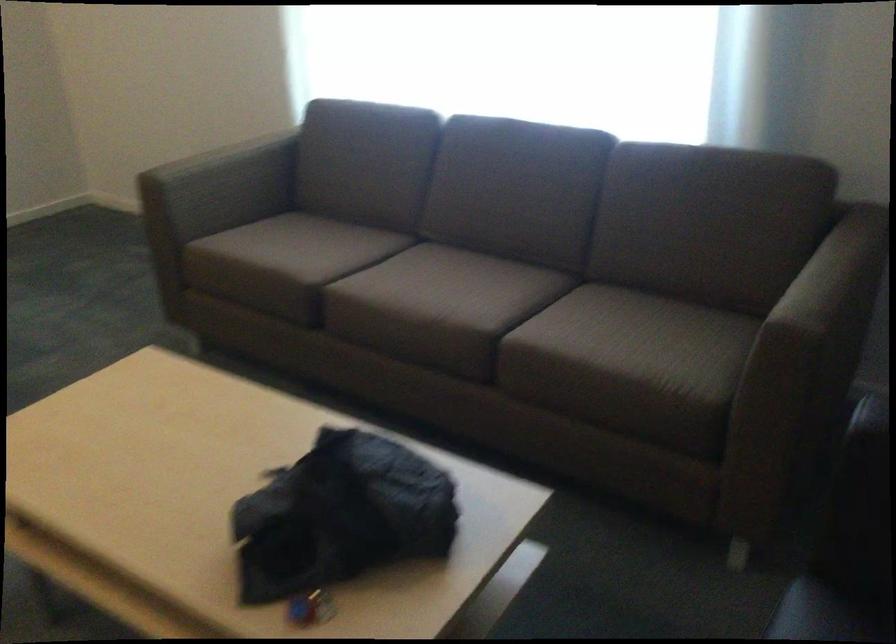
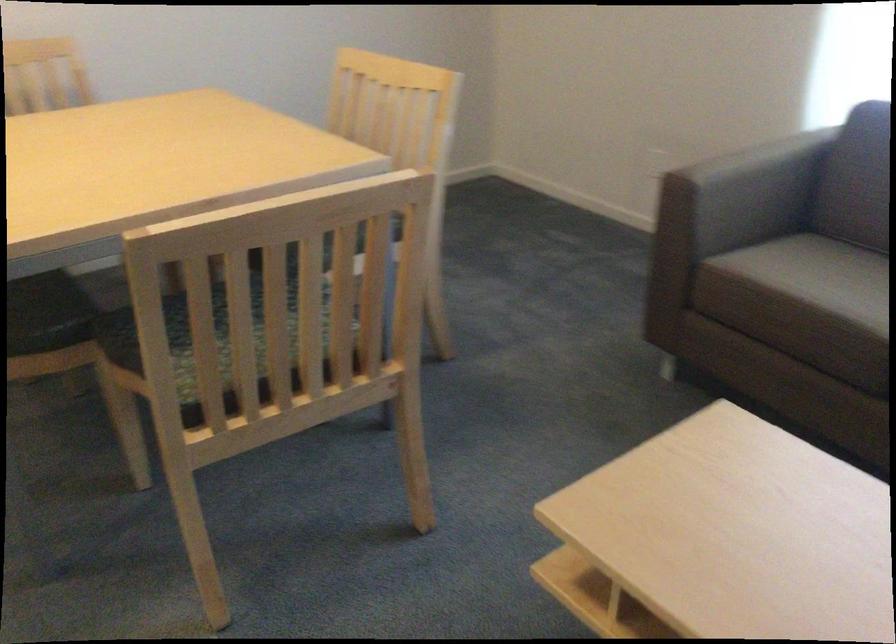
Where in the second image is the point corresponding to [225,180] from the first image?

(746, 192)